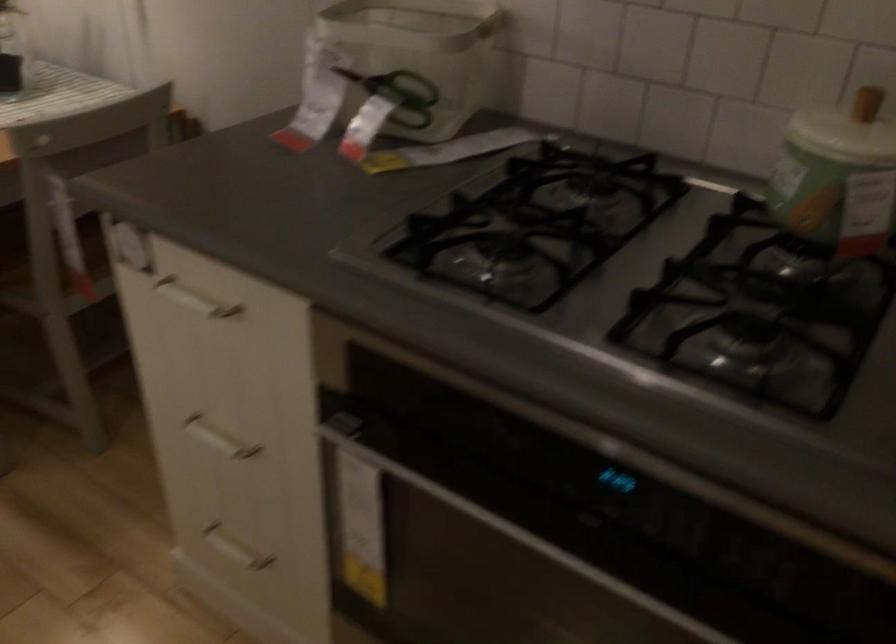
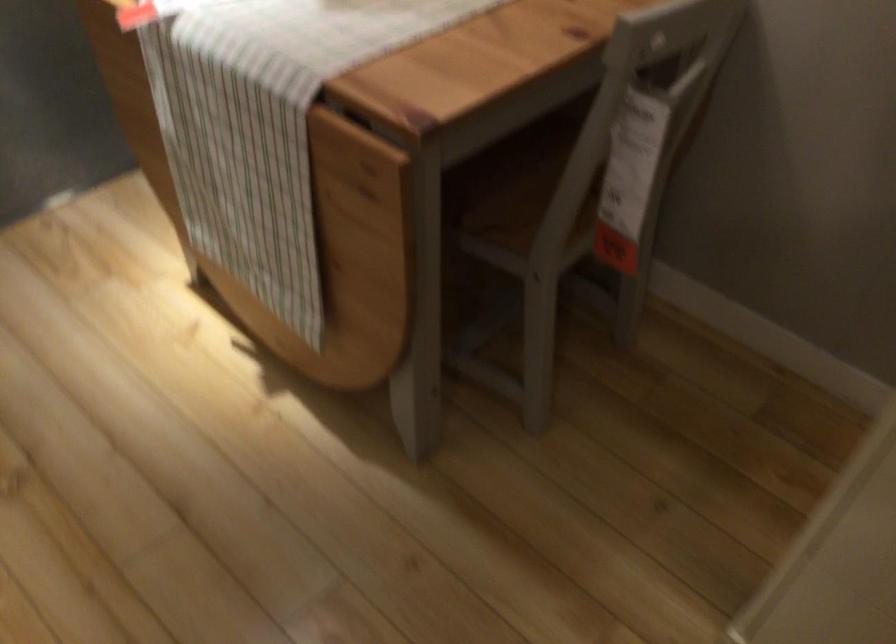
Question: How did the camera likely rotate?

Choices:
 (A) Left
 (B) Right
 (C) Up
 (D) Down

Answer: (D)